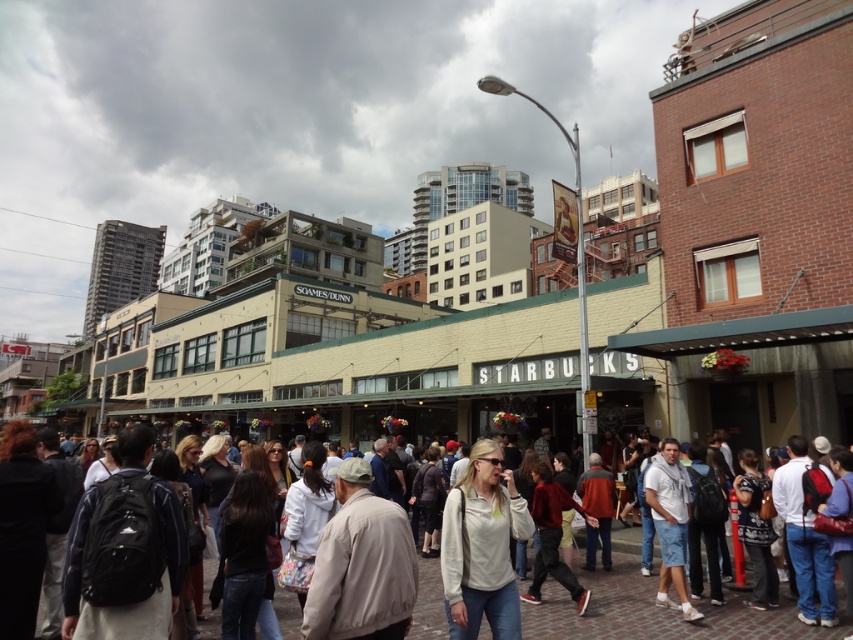
You are a photographer trying to capture a clear shot of both the white cotton shirt at center and the white matte jacket at center in the bustling urban scene. Since both are in the same area, which one will appear taller in your photo?

The white cotton shirt at center will appear taller in the photo because it has a greater height compared to the white matte jacket at center.

You are a photographer trying to capture a candid shot of the white cotton shirt at center and the white matte jacket at center in the bustling urban scene. Since both are white, you need to adjust your camera focus to ensure clarity. Which object should you focus on first to capture both in the same frame without moving the camera?

The white cotton shirt at center is located below the white matte jacket at center, so you should focus on the white matte jacket at center first as it is higher up, allowing the white cotton shirt at center to naturally fall into the frame below it.

You are a photographer trying to capture a clear shot of both the white cotton shirt at center and the white matte jacket at center. Since both are in the same area, you want to ensure your camera can focus on both. Given their sizes, which one might require you to adjust your focus settings more carefully to avoid blurriness?

The white cotton shirt at center is bigger than the white matte jacket at center. Since the white cotton shirt at center is larger, it might require more careful focus adjustments to ensure clarity, especially if it occupies a significant portion of the frame.